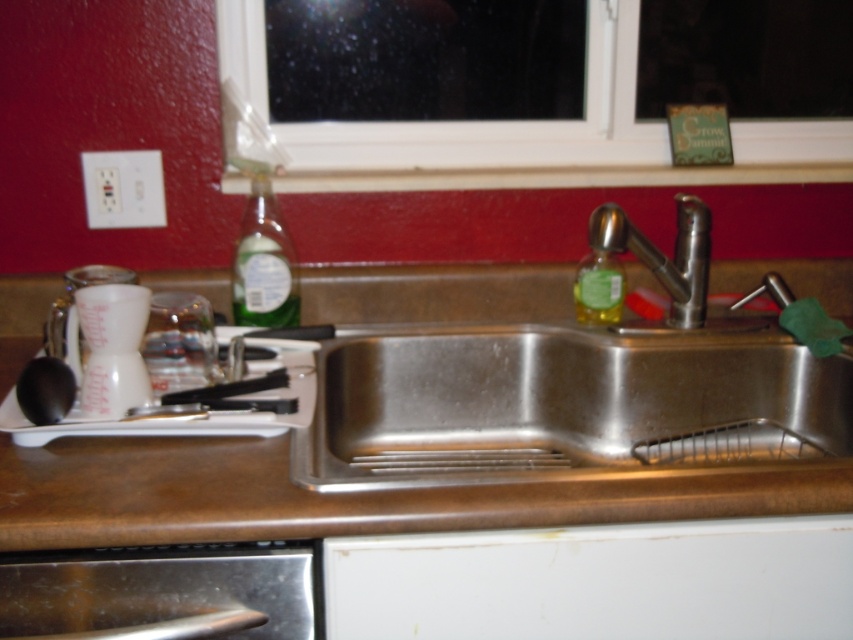
Can you confirm if stainless steel sink at center is shorter than translucent green liquid at sink left?

No, stainless steel sink at center is not shorter than translucent green liquid at sink left.

Is stainless steel sink at center taller than translucent green liquid at sink left?

Correct, stainless steel sink at center is much taller as translucent green liquid at sink left.

Locate an element on the screen. stainless steel sink at center is located at coordinates (560, 406).

Image resolution: width=853 pixels, height=640 pixels. What are the coordinates of `stainless steel sink at center` in the screenshot? It's located at (560, 406).

What do you see at coordinates (343, 496) in the screenshot? The image size is (853, 640). I see `brown matte counter top at center` at bounding box center [343, 496].

Which is below, brown matte counter top at center or translucent green liquid at sink left?

Positioned lower is brown matte counter top at center.

Where is `brown matte counter top at center`? brown matte counter top at center is located at coordinates (343, 496).

Does brown matte counter top at center appear on the right side of green glass bottle at upper right?

In fact, brown matte counter top at center is to the left of green glass bottle at upper right.

The image size is (853, 640). I want to click on brown matte counter top at center, so click(343, 496).

At what (x,y) coordinates should I click in order to perform the action: click on brown matte counter top at center. Please return your answer as a coordinate pair (x, y). Looking at the image, I should click on (343, 496).